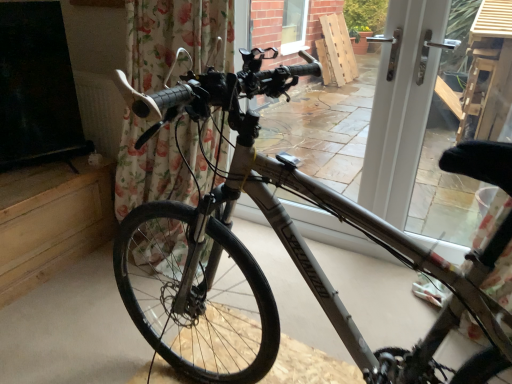
Question: Choose the correct answer: Is floral fabric curtain at left inside silver metallic bicycle at center or outside it?

Choices:
 (A) inside
 (B) outside

Answer: (B)

Question: Is floral fabric curtain at left bigger or smaller than silver metallic bicycle at center?

Choices:
 (A) small
 (B) big

Answer: (A)

Question: Which of these objects is positioned farthest from the white plastic door at center?

Choices:
 (A) floral fabric curtain at left
 (B) silver metallic bicycle at center

Answer: (A)

Question: Considering the real-world distances, which object is farthest from the white plastic door at center?

Choices:
 (A) silver metallic bicycle at center
 (B) floral fabric curtain at left

Answer: (B)